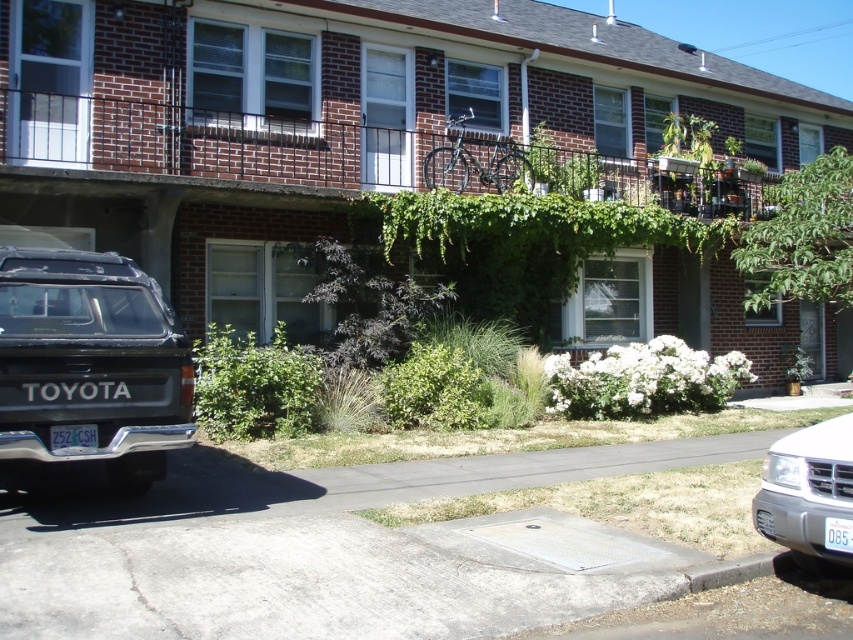
You are a delivery person approaching the residential brick building. You need to park your white matte suv at lower right and place your delivery box on the white plastic license plate at lower right. Is the license plate accessible for placing the box?

The white matte suv at lower right is to the right of the white plastic license plate at lower right, so the license plate is positioned to the left of the suv. Since the suv is parked to the right of the license plate, the license plate should be accessible for placing the delivery box as it is located to the left side of the vehicle.